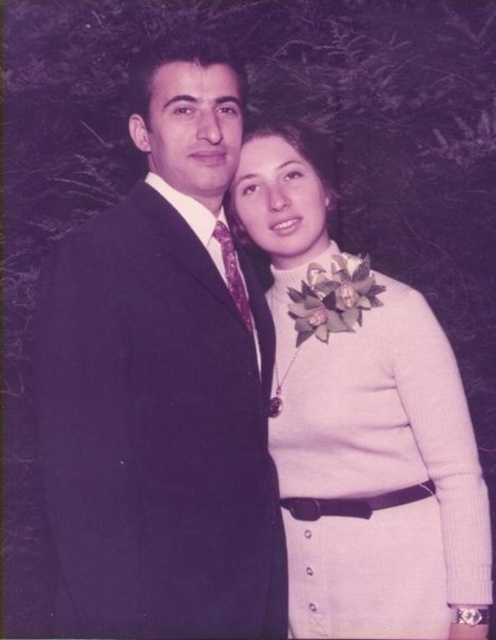
You are a photographer at a formal event. You need to capture a photo where both the satin black suit at center and the white knitted dress at center are clearly visible. Since the background is dark, you decide to use a spotlight. Where should you position the spotlight to ensure both outfits are illuminated without creating harsh shadows?

The satin black suit at center is thinner than the white knitted dress at center. Position the spotlight slightly to the side of the thinner satin black suit at center so that it can evenly illuminate both outfits while minimizing harsh shadows.

You are a photographer who needs to adjust your camera focus to capture the satin black suit at center. Given that the focus point of your camera is currently at point (x=163, y=385), will the satin black suit at center be in focus?

Yes, the satin black suit at center is located exactly at point (x=163, y=385), so the focus point is correctly set to capture it in focus.